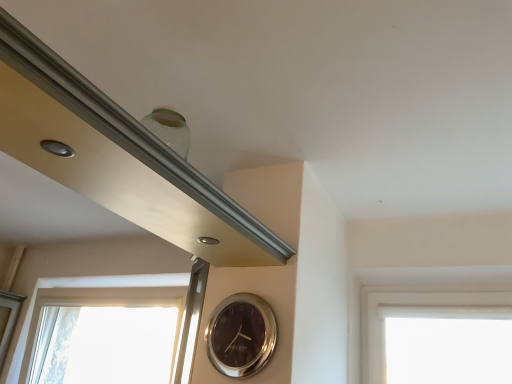
What do you see at coordinates (85, 287) in the screenshot? The width and height of the screenshot is (512, 384). I see `transparent glass window at lower left` at bounding box center [85, 287].

Find the location of `transparent glass window at lower left`. transparent glass window at lower left is located at coordinates (85, 287).

Identify the location of shiny silver clock at center. The height and width of the screenshot is (384, 512). (241, 335).

The image size is (512, 384). Describe the element at coordinates (241, 335) in the screenshot. I see `shiny silver clock at center` at that location.

Measure the distance between shiny silver clock at center and camera.

The depth of shiny silver clock at center is 4.72 feet.

You are a GUI agent. You are given a task and a screenshot of the screen. Output one action in this format:
    pyautogui.click(x=<x>, y=<y>)
    Task: Click on the transparent glass window at lower left
    Image resolution: width=512 pixels, height=384 pixels.
    Given the screenshot: What is the action you would take?
    pyautogui.click(x=85, y=287)

Would you say transparent glass window at lower left is to the left or to the right of shiny silver clock at center in the picture?

In the image, transparent glass window at lower left appears on the left side of shiny silver clock at center.

In the image, is transparent glass window at lower left positioned in front of or behind shiny silver clock at center?

transparent glass window at lower left is behind shiny silver clock at center.

Is point (26, 323) positioned after point (269, 341)?

Yes, point (26, 323) is farther from viewer.

From the image's perspective, would you say transparent glass window at lower left is positioned over shiny silver clock at center?

No, from the image's perspective, transparent glass window at lower left is not on top of shiny silver clock at center.

From a real-world perspective, is transparent glass window at lower left on top of shiny silver clock at center?

Indeed, from a real-world perspective, transparent glass window at lower left stands above shiny silver clock at center.

Which object is wider, transparent glass window at lower left or shiny silver clock at center?

Wider between the two is transparent glass window at lower left.

Is transparent glass window at lower left taller or shorter than shiny silver clock at center?

Clearly, transparent glass window at lower left is taller compared to shiny silver clock at center.

Is transparent glass window at lower left bigger or smaller than shiny silver clock at center?

transparent glass window at lower left is bigger than shiny silver clock at center.

Would you say transparent glass window at lower left is inside or outside shiny silver clock at center?

transparent glass window at lower left is not inside shiny silver clock at center, it's outside.

Would you consider transparent glass window at lower left to be distant from shiny silver clock at center?

Absolutely, transparent glass window at lower left is distant from shiny silver clock at center.

Is transparent glass window at lower left turned away from shiny silver clock at center?

No, transparent glass window at lower left is not facing away from shiny silver clock at center.

Can you tell me how much transparent glass window at lower left and shiny silver clock at center differ in facing direction?

The facing directions of transparent glass window at lower left and shiny silver clock at center are 0.971 degrees apart.

How much distance is there between transparent glass window at lower left and shiny silver clock at center?

transparent glass window at lower left and shiny silver clock at center are 1.34 meters apart.

At what (x,y) coordinates should I click in order to perform the action: click on window behind the shiny silver clock at center. Please return your answer as a coordinate pair (x, y). The image size is (512, 384). Looking at the image, I should click on (85, 287).

In the scene shown: Considering the relative positions of shiny silver clock at center and transparent glass window at lower left in the image provided, is shiny silver clock at center to the left or to the right of transparent glass window at lower left?

shiny silver clock at center is positioned on transparent glass window at lower left's right side.

Is shiny silver clock at center further to camera compared to transparent glass window at lower left?

No, it is not.

Between point (230, 348) and point (148, 276), which one is positioned in front?

The point (230, 348) is closer to the camera.

From the image's perspective, is shiny silver clock at center below transparent glass window at lower left?

Incorrect, from the image's perspective, shiny silver clock at center is higher than transparent glass window at lower left.

From a real-world perspective, which object rests below the other?

shiny silver clock at center, from a real-world perspective.

Which of these two, shiny silver clock at center or transparent glass window at lower left, is wider?

transparent glass window at lower left is wider.

Can you confirm if shiny silver clock at center is taller than transparent glass window at lower left?

No.

Considering the sizes of objects shiny silver clock at center and transparent glass window at lower left in the image provided, who is bigger, shiny silver clock at center or transparent glass window at lower left?

Bigger between the two is transparent glass window at lower left.

Would you say shiny silver clock at center is inside or outside transparent glass window at lower left?

shiny silver clock at center is outside transparent glass window at lower left.

Is shiny silver clock at center not near transparent glass window at lower left?

Yes, shiny silver clock at center is far from transparent glass window at lower left.

Could you tell me if shiny silver clock at center is facing transparent glass window at lower left?

No, shiny silver clock at center is not oriented towards transparent glass window at lower left.

What's the angular difference between shiny silver clock at center and transparent glass window at lower left's facing directions?

0.971 degrees separate the facing orientations of shiny silver clock at center and transparent glass window at lower left.

Find the location of a particular element. window positioned vertically above the shiny silver clock at center (from a real-world perspective) is located at coordinates (85, 287).

Identify the location of window on the left of shiny silver clock at center. The height and width of the screenshot is (384, 512). (85, 287).

Locate an element on the screen. The image size is (512, 384). wall clock that appears above the transparent glass window at lower left (from the image's perspective) is located at coordinates 241,335.